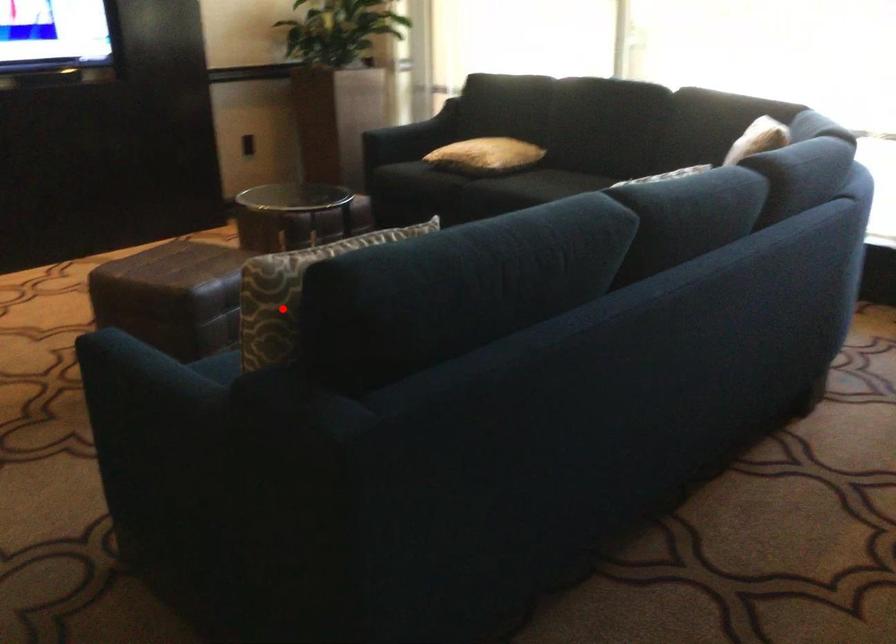
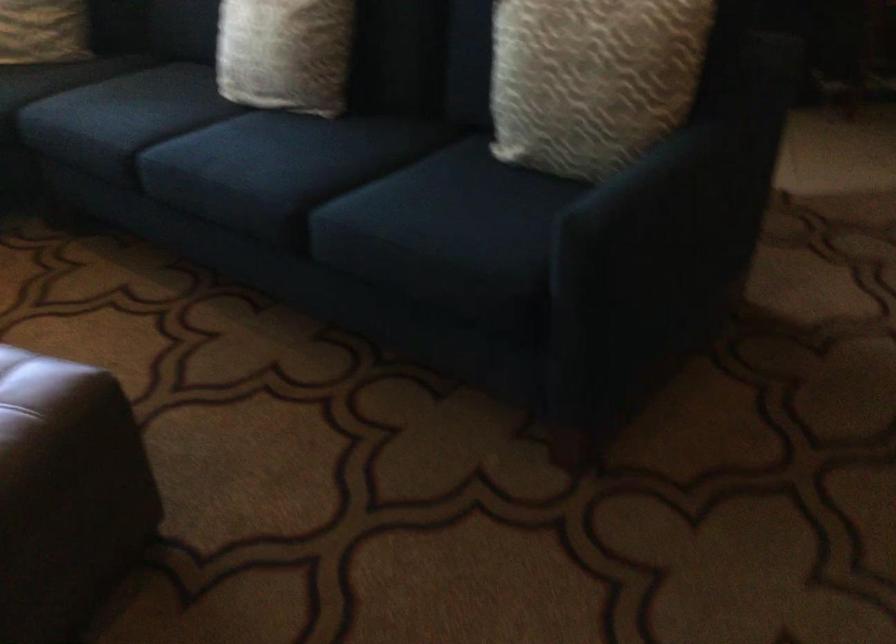
Question: I am providing you with two images of the same scene from different viewpoints. In image1, a red point is highlighted. Considering the same 3D point in image2, which of the following is correct?

Choices:
 (A) It is closer
 (B) It is farther

Answer: (B)